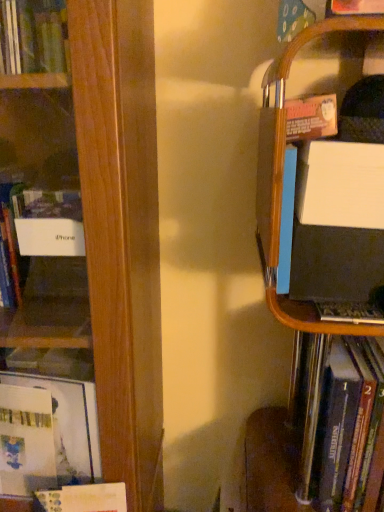
Question: Is matte black laptop at right bigger than wooden bookshelf at left, which ranks as the first book in left-to-right order?

Choices:
 (A) yes
 (B) no

Answer: (B)

Question: From the image's perspective, is matte black laptop at right below wooden bookshelf at left, which ranks as the 3th book in right-to-left order?

Choices:
 (A) no
 (B) yes

Answer: (B)

Question: Does matte black laptop at right lie in front of wooden bookshelf at left, which ranks as the first book in left-to-right order?

Choices:
 (A) yes
 (B) no

Answer: (B)

Question: Is matte black laptop at right thinner than wooden bookshelf at left, which ranks as the 3th book in right-to-left order?

Choices:
 (A) no
 (B) yes

Answer: (B)

Question: Does matte black laptop at right have a greater height compared to wooden bookshelf at left, which ranks as the first book in left-to-right order?

Choices:
 (A) no
 (B) yes

Answer: (A)

Question: Is black matte laptop at right, which is counted as the first book, starting from the right, situated inside wooden bookshelf at left, which ranks as the 3th book in right-to-left order, or outside?

Choices:
 (A) inside
 (B) outside

Answer: (B)

Question: Would you say black matte laptop at right, acting as the 3th book starting from the left, is to the left or to the right of wooden bookshelf at left, which ranks as the 3th book in right-to-left order, in the picture?

Choices:
 (A) right
 (B) left

Answer: (A)

Question: Is black matte laptop at right, which is counted as the first book, starting from the right, wider or thinner than wooden bookshelf at left, which ranks as the first book in left-to-right order?

Choices:
 (A) thin
 (B) wide

Answer: (A)

Question: Is point (347, 466) closer or farther from the camera than point (110, 434)?

Choices:
 (A) closer
 (B) farther

Answer: (A)

Question: Is white paper at lower left, the second book viewed from the right, spatially inside matte black laptop at right, or outside of it?

Choices:
 (A) outside
 (B) inside

Answer: (A)

Question: Considering the relative positions of white paper at lower left, the second book viewed from the left, and matte black laptop at right in the image provided, is white paper at lower left, the second book viewed from the left, to the left or to the right of matte black laptop at right?

Choices:
 (A) right
 (B) left

Answer: (B)

Question: Is white paper at lower left, the second book viewed from the left, in front of or behind matte black laptop at right in the image?

Choices:
 (A) front
 (B) behind

Answer: (B)

Question: Based on their sizes in the image, would you say white paper at lower left, the second book viewed from the left, is bigger or smaller than matte black laptop at right?

Choices:
 (A) big
 (B) small

Answer: (B)

Question: Is point (294, 346) positioned closer to the camera than point (81, 504)?

Choices:
 (A) closer
 (B) farther

Answer: (B)

Question: Is matte black laptop at right bigger or smaller than white paper at lower left, the second book viewed from the left?

Choices:
 (A) big
 (B) small

Answer: (A)